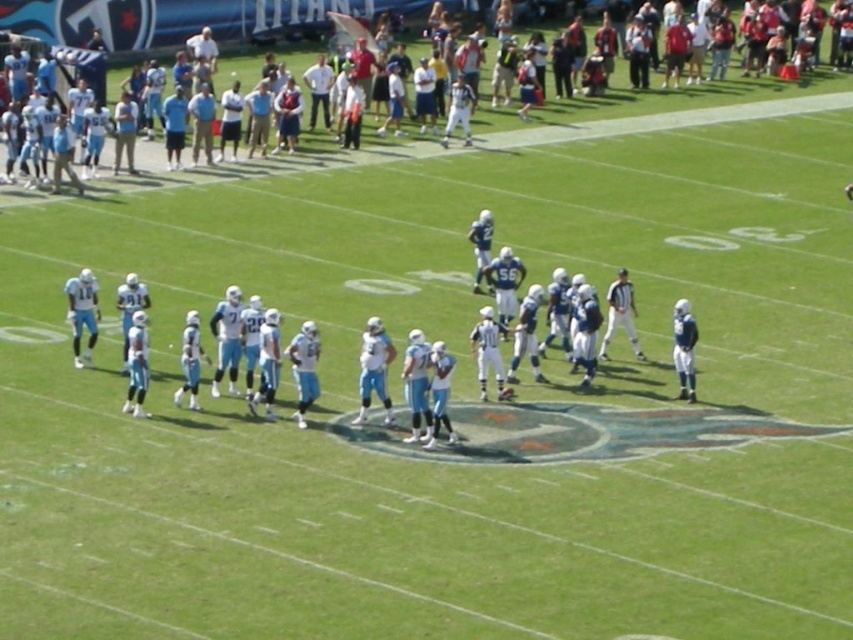
The image size is (853, 640). In order to click on light blue fabric football team at center in this screenshot , I will do `click(494, 390)`.

Is light blue fabric football team at center to the left of light blue jersey at center from the viewer's perspective?

Incorrect, light blue fabric football team at center is not on the left side of light blue jersey at center.

In order to click on light blue fabric football team at center in this screenshot , I will do `click(494, 390)`.

Locate an element on the screen. light blue fabric football team at center is located at coordinates (494, 390).